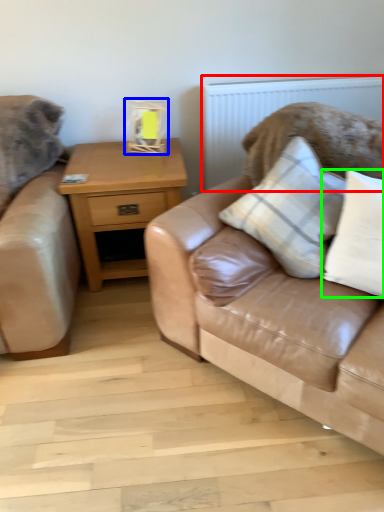
Question: Considering the real-world distances, which object is closest to radiator (highlighted by a red box)? table lamp (highlighted by a blue box) or pillow (highlighted by a green box).

Choices:
 (A) table lamp
 (B) pillow

Answer: (A)